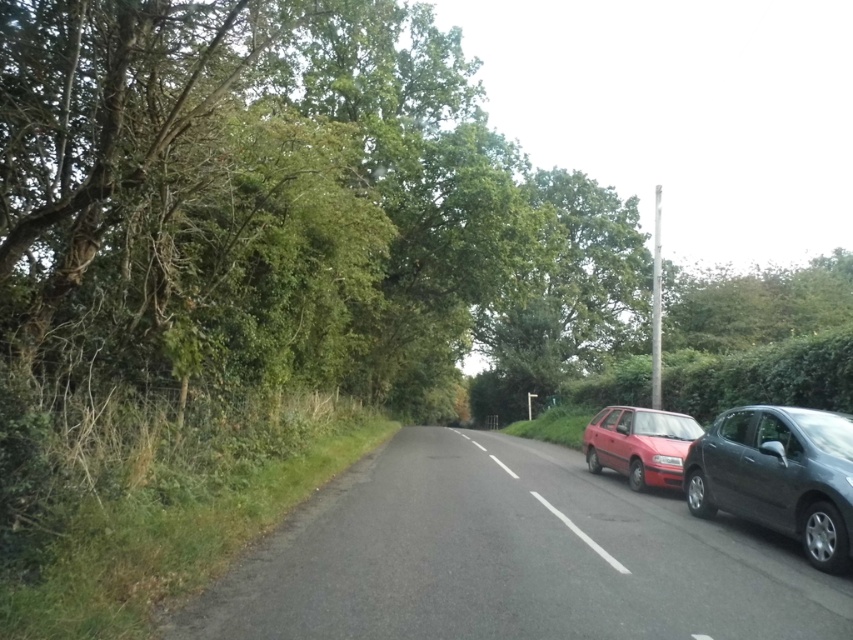
Who is positioned more to the left, metallic gray hatchback at right or matte red hatchback at center-right?

Positioned to the left is matte red hatchback at center-right.

Is point (685, 476) positioned behind point (619, 468)?

No, (685, 476) is closer to viewer.

Measure the distance between point (785, 524) and camera.

A distance of 7.12 meters exists between point (785, 524) and camera.

Locate an element on the screen. This screenshot has height=640, width=853. metallic gray hatchback at right is located at coordinates point(778,476).

Is green leafy tree at center below matte red hatchback at center-right?

No, green leafy tree at center is not below matte red hatchback at center-right.

Is point (537, 307) more distant than point (647, 426)?

Yes, point (537, 307) is behind point (647, 426).

Who is more distant from viewer, [486,384] or [605,406]?

Positioned behind is point [486,384].

Locate an element on the screen. green leafy tree at center is located at coordinates (577, 296).

Does green leafy tree at center have a lesser height compared to red plastic license plate at center?

No.

Does green leafy tree at center have a larger size compared to red plastic license plate at center?

Correct, green leafy tree at center is larger in size than red plastic license plate at center.

Between point (521, 330) and point (674, 460), which one is positioned in front?

Positioned in front is point (674, 460).

Where is `green leafy tree at center`? The image size is (853, 640). green leafy tree at center is located at coordinates (577, 296).